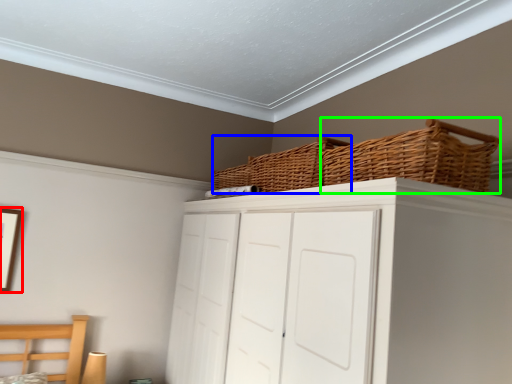
Question: Which object is positioned farthest from picture frame (highlighted by a red box)? Select from basket (highlighted by a blue box) and basket (highlighted by a green box).

Choices:
 (A) basket
 (B) basket

Answer: (B)